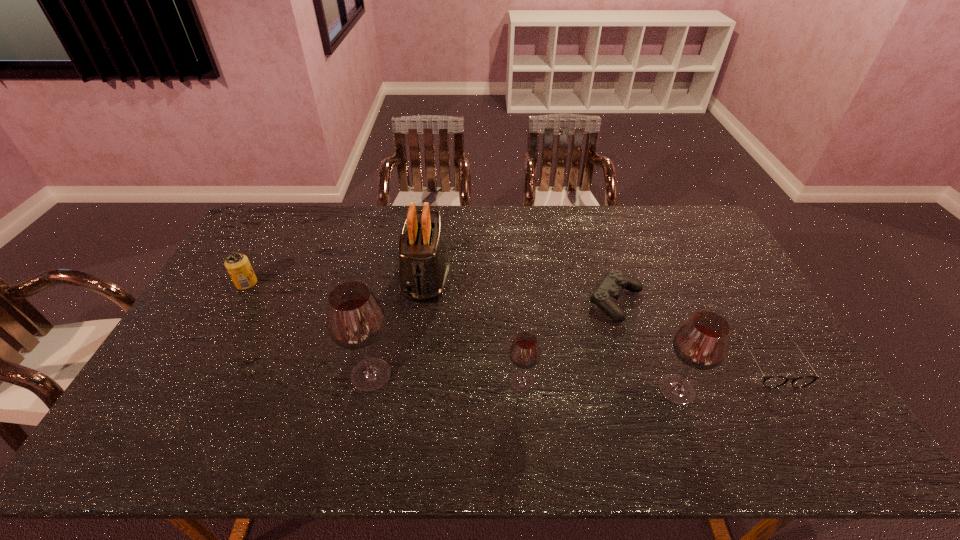
Locate an element on the screen. free space that is in between the spectacles and the fourth tallest object is located at coordinates (646, 373).

Locate an element on the screen. The height and width of the screenshot is (540, 960). empty location between the shortest object and the fifth tallest object is located at coordinates (509, 323).

Image resolution: width=960 pixels, height=540 pixels. Find the location of `free space between the fourth object from left to right and the leftmost wineglass`. free space between the fourth object from left to right and the leftmost wineglass is located at coordinates click(x=446, y=379).

The height and width of the screenshot is (540, 960). Identify the location of unoccupied area between the leftmost object and the rightmost object. (509, 323).

This screenshot has height=540, width=960. I want to click on object that stands as the fifth closest to the leftmost object, so click(x=701, y=343).

Choose which object is the second nearest neighbor to the leftmost wineglass. Please provide its 2D coordinates. Your answer should be formatted as a tuple, i.e. [(x, y)], where the tuple contains the x and y coordinates of a point satisfying the conditions above.

[(524, 353)]

You are a GUI agent. You are given a task and a screenshot of the screen. Output one action in this format:
    pyautogui.click(x=<x>, y=<y>)
    Task: Click on the closest wineglass to the shortest wineglass
    Image resolution: width=960 pixels, height=540 pixels.
    Given the screenshot: What is the action you would take?
    tap(355, 320)

Identify the location of wineglass object that ranks as the second closest to the leftmost wineglass. This screenshot has width=960, height=540. coord(701,343).

This screenshot has height=540, width=960. I want to click on free spot that satisfies the following two spatial constraints: 1. on the front side of the leftmost object; 2. on the right side of the control, so coord(236,302).

This screenshot has width=960, height=540. I want to click on vacant space that satisfies the following two spatial constraints: 1. on the side of the toaster with the control lever; 2. on the left side of the control, so click(x=422, y=302).